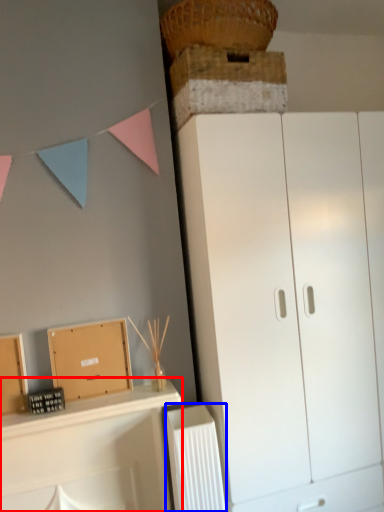
Question: Among these objects, which one is nearest to the camera, shelf (highlighted by a red box) or radiator (highlighted by a blue box)?

Choices:
 (A) shelf
 (B) radiator

Answer: (A)